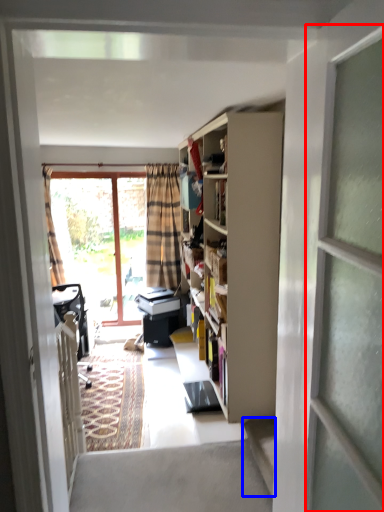
Question: Which of the following is the closest to the observer, screen door (highlighted by a red box) or stairwell (highlighted by a blue box)?

Choices:
 (A) screen door
 (B) stairwell

Answer: (A)